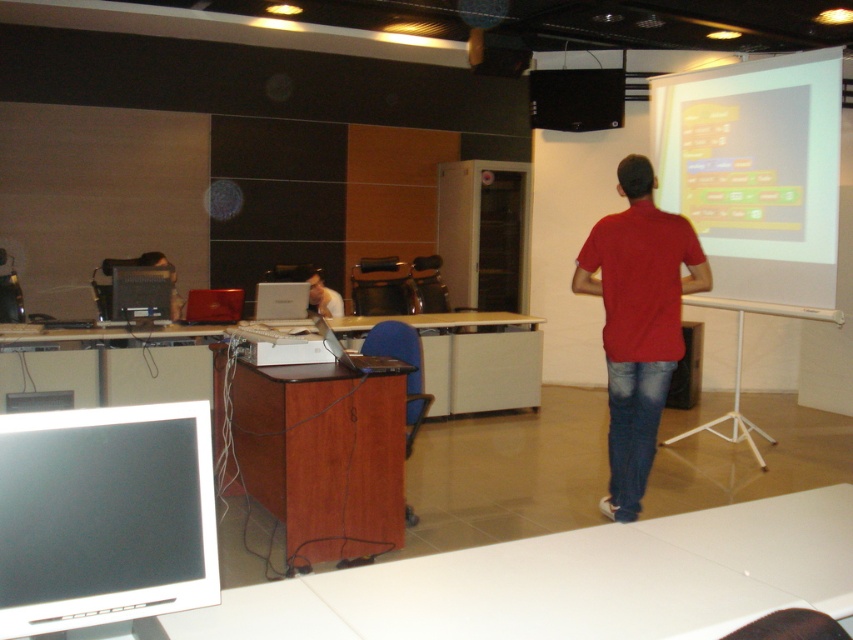
Question: Which point appears closest to the camera in this image?

Choices:
 (A) (776, 260)
 (B) (157, 298)
 (C) (170, 300)

Answer: (A)

Question: Is black plastic monitor at left above matte black monitor at center?

Choices:
 (A) yes
 (B) no

Answer: (A)

Question: Estimate the real-world distances between objects in this image. Which object is closer to the matte black laptop at center?

Choices:
 (A) white matte projection screen at upper right
 (B) red cotton shirt at center
 (C) matte black monitor at center

Answer: (C)

Question: Is black glossy monitor at lower left to the left of silver metallic laptop at center from the viewer's perspective?

Choices:
 (A) yes
 (B) no

Answer: (A)

Question: Among these objects, which one is farthest from the camera?

Choices:
 (A) white matte projection screen at upper right
 (B) red cotton shirt at center

Answer: (A)

Question: Where is black plastic monitor at left located in relation to matte black laptop at center in the image?

Choices:
 (A) left
 (B) right

Answer: (A)